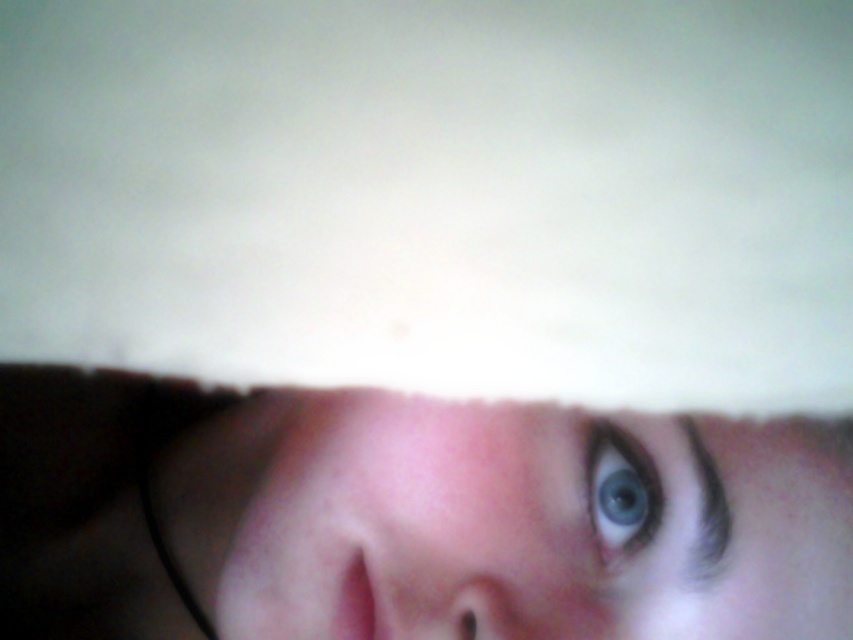
Question: Is smooth skin face at center wider than blue glossy eye at center?

Choices:
 (A) yes
 (B) no

Answer: (A)

Question: Is smooth skin face at center in front of blue glossy eye at center?

Choices:
 (A) no
 (B) yes

Answer: (B)

Question: Is smooth skin face at center thinner than blue glossy eye at center?

Choices:
 (A) yes
 (B) no

Answer: (B)

Question: Which point appears closest to the camera in this image?

Choices:
 (A) (636, 532)
 (B) (682, 544)

Answer: (B)